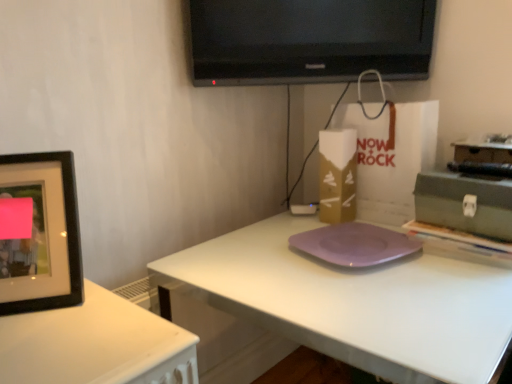
Question: From the image's perspective, is black matte picture frame at left beneath black glossy tv at upper center?

Choices:
 (A) yes
 (B) no

Answer: (A)

Question: Is black matte picture frame at left positioned far away from black glossy tv at upper center?

Choices:
 (A) no
 (B) yes

Answer: (A)

Question: Is black matte picture frame at left further to the viewer compared to black glossy tv at upper center?

Choices:
 (A) yes
 (B) no

Answer: (B)

Question: Can you confirm if black matte picture frame at left is thinner than black glossy tv at upper center?

Choices:
 (A) no
 (B) yes

Answer: (A)

Question: Is black matte picture frame at left taller than black glossy tv at upper center?

Choices:
 (A) no
 (B) yes

Answer: (A)

Question: Is black matte picture frame at left positioned in front of black glossy tv at upper center?

Choices:
 (A) yes
 (B) no

Answer: (A)

Question: Considering the relative positions of purple matte plate at center and purple matte pad at center in the image provided, is purple matte plate at center to the right of purple matte pad at center from the viewer's perspective?

Choices:
 (A) yes
 (B) no

Answer: (A)

Question: From the image's perspective, would you say purple matte plate at center is shown under purple matte pad at center?

Choices:
 (A) yes
 (B) no

Answer: (A)

Question: Can you confirm if purple matte plate at center is bigger than purple matte pad at center?

Choices:
 (A) no
 (B) yes

Answer: (B)

Question: Is purple matte plate at center oriented away from purple matte pad at center?

Choices:
 (A) yes
 (B) no

Answer: (B)

Question: Is purple matte plate at center located outside purple matte pad at center?

Choices:
 (A) yes
 (B) no

Answer: (A)

Question: From the image's perspective, does purple matte plate at center appear higher than purple matte pad at center?

Choices:
 (A) no
 (B) yes

Answer: (A)

Question: Is black matte picture frame at left thinner than purple matte plate at center?

Choices:
 (A) no
 (B) yes

Answer: (B)